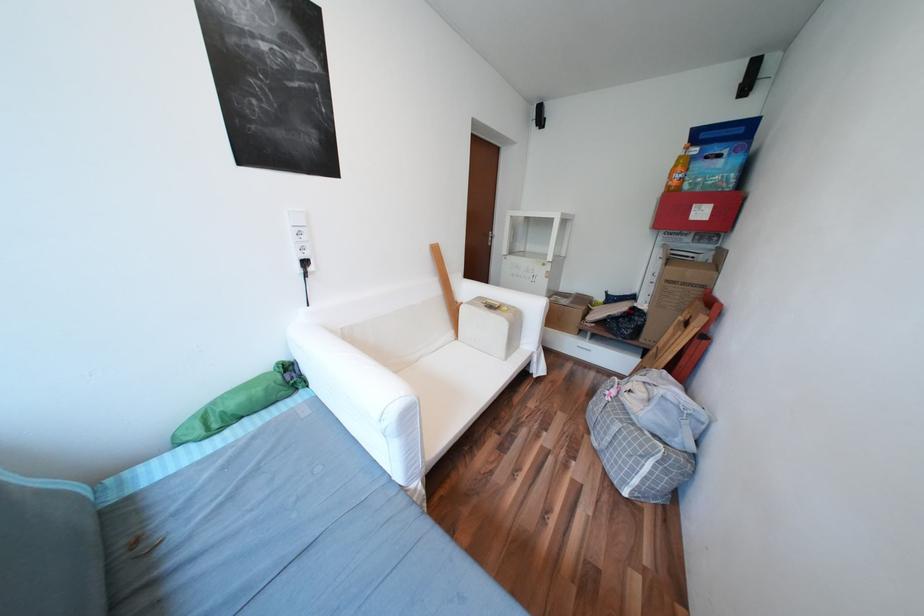
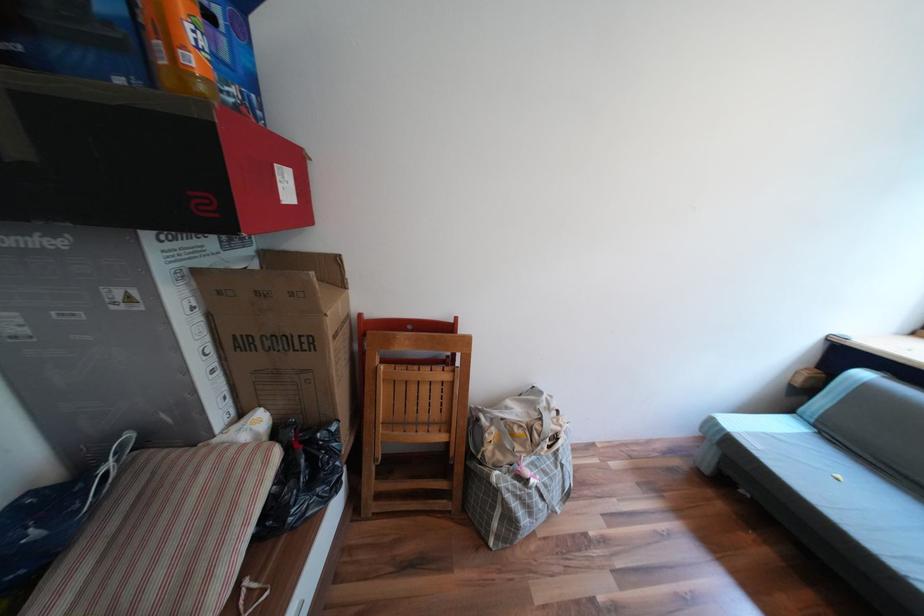
Find the pixel in the second image that matches pixel 665 275 in the first image.

(219, 349)